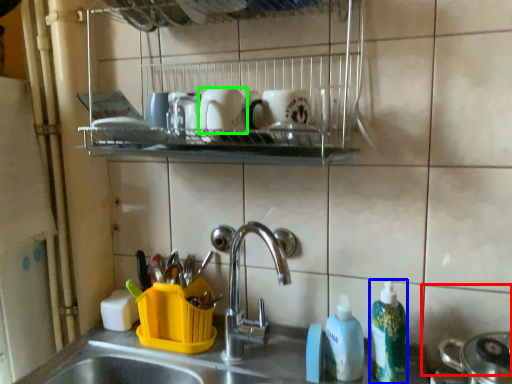
Question: Estimate the real-world distances between objects in this image. Which object is farther from tile (highlighted by a red box), cleaning product (highlighted by a blue box) or mug (highlighted by a green box)?

Choices:
 (A) cleaning product
 (B) mug

Answer: (B)